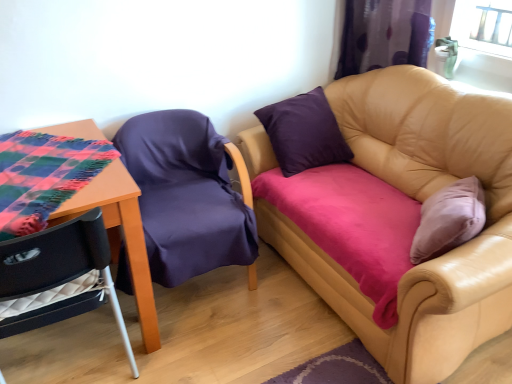
This screenshot has width=512, height=384. Find the location of `plaid fabric-covered table at left`. plaid fabric-covered table at left is located at coordinates [x=119, y=235].

The image size is (512, 384). What do you see at coordinates (60, 263) in the screenshot?
I see `velvet purple chair at lower left, arranged as the 2th chair when viewed from the right` at bounding box center [60, 263].

In order to face purple fabric curtain at upper right, should I rotate leftwards or rightwards?

Rotate right and turn 17.096 degrees.

Where is `plaid fabric-covered table at left`? Image resolution: width=512 pixels, height=384 pixels. plaid fabric-covered table at left is located at coordinates (119, 235).

In the scene shown: Can you confirm if purple fabric curtain at upper right is positioned to the left of velvet purple chair at lower left, arranged as the 2th chair when viewed from the right?

Incorrect, purple fabric curtain at upper right is not on the left side of velvet purple chair at lower left, arranged as the 2th chair when viewed from the right.

Between purple fabric curtain at upper right and velvet purple chair at lower left, arranged as the 2th chair when viewed from the right, which one has larger width?

velvet purple chair at lower left, arranged as the 2th chair when viewed from the right.

Consider the image. Is purple fabric curtain at upper right closer to camera compared to velvet purple chair at lower left, arranged as the 2th chair when viewed from the right?

No.

From the image's perspective, is purple fabric curtain at upper right located above or below velvet purple chair at lower left, arranged as the 2th chair when viewed from the right?

purple fabric curtain at upper right is situated higher than velvet purple chair at lower left, arranged as the 2th chair when viewed from the right, in the image.

In the image, is plaid fabric-covered table at left on the left side or the right side of tan leather couch at upper right?

Clearly, plaid fabric-covered table at left is on the left of tan leather couch at upper right in the image.

Is plaid fabric-covered table at left facing away from tan leather couch at upper right?

No.

Locate an element on the screen. The image size is (512, 384). table above the tan leather couch at upper right (from the image's perspective) is located at coordinates (119, 235).

Is plaid fabric-covered table at left not near tan leather couch at upper right?

Absolutely, plaid fabric-covered table at left is distant from tan leather couch at upper right.

Considering the positions of points (248, 138) and (384, 30), is point (248, 138) closer to camera compared to point (384, 30)?

That is False.

Considering the sizes of objects tan leather couch at upper right and purple fabric curtain at upper right in the image provided, who is bigger, tan leather couch at upper right or purple fabric curtain at upper right?

With larger size is tan leather couch at upper right.

From their relative heights in the image, would you say tan leather couch at upper right is taller or shorter than purple fabric curtain at upper right?

tan leather couch at upper right is taller than purple fabric curtain at upper right.

Is velvet purple chair at lower left, which ranks as the 1th chair in left-to-right order, looking in the opposite direction of tan leather couch at upper right?

velvet purple chair at lower left, which ranks as the 1th chair in left-to-right order, does not have its back to tan leather couch at upper right.

Are velvet purple chair at lower left, which ranks as the 1th chair in left-to-right order, and tan leather couch at upper right far apart?

Absolutely, velvet purple chair at lower left, which ranks as the 1th chair in left-to-right order, is distant from tan leather couch at upper right.

Considering the positions of points (94, 214) and (276, 214), is point (94, 214) farther from camera compared to point (276, 214)?

That is False.

Can you tell me how much velvet purple chair at lower left, which ranks as the 1th chair in left-to-right order, and tan leather couch at upper right differ in facing direction?

velvet purple chair at lower left, which ranks as the 1th chair in left-to-right order, and tan leather couch at upper right are facing 92.3 degrees away from each other.

From the image's perspective, which one is positioned lower, purple fabric curtain at upper right or purple fabric chair at left, the second chair in the left-to-right sequence?

purple fabric chair at left, the second chair in the left-to-right sequence, is shown below in the image.

In terms of width, does purple fabric curtain at upper right look wider or thinner when compared to purple fabric chair at left, the second chair in the left-to-right sequence?

Considering their sizes, purple fabric curtain at upper right looks slimmer than purple fabric chair at left, the second chair in the left-to-right sequence.

From the picture: Is purple fabric curtain at upper right aimed at purple fabric chair at left, the first chair viewed from the right?

Yes.

Could you tell me if plaid fabric-covered table at left is facing purple fabric curtain at upper right?

No, plaid fabric-covered table at left is not facing towards purple fabric curtain at upper right.

Between point (143, 288) and point (356, 23), which one is positioned behind?

Positioned behind is point (356, 23).

From the image's perspective, is plaid fabric-covered table at left on top of purple fabric curtain at upper right?

No, from the image's perspective, plaid fabric-covered table at left is not over purple fabric curtain at upper right.

Who is shorter, plaid fabric-covered table at left or purple fabric curtain at upper right?

plaid fabric-covered table at left is shorter.

From a real-world perspective, is plaid fabric-covered table at left beneath purple fabric chair at left, the first chair viewed from the right?

No, from a real-world perspective, plaid fabric-covered table at left is not beneath purple fabric chair at left, the first chair viewed from the right.

Is plaid fabric-covered table at left far from purple fabric chair at left, the second chair in the left-to-right sequence?

Actually, plaid fabric-covered table at left and purple fabric chair at left, the second chair in the left-to-right sequence, are a little close together.

From their relative heights in the image, would you say plaid fabric-covered table at left is taller or shorter than purple fabric chair at left, the second chair in the left-to-right sequence?

Clearly, plaid fabric-covered table at left is shorter compared to purple fabric chair at left, the second chair in the left-to-right sequence.

From the image's perspective, which chair is the 2nd one below the purple fabric curtain at upper right? Please provide its 2D coordinates.

[(60, 263)]

Identify the location of studio couch lying on the right of plaid fabric-covered table at left. This screenshot has height=384, width=512. (421, 201).

Based on their spatial positions, is plaid fabric-covered table at left or purple fabric chair at left, the second chair in the left-to-right sequence, further from purple fabric curtain at upper right?

plaid fabric-covered table at left is further to purple fabric curtain at upper right.

Which object lies nearer to the anchor point tan leather couch at upper right, purple fabric chair at left, the first chair viewed from the right, or velvet purple chair at lower left, which ranks as the 1th chair in left-to-right order?

The object closer to tan leather couch at upper right is purple fabric chair at left, the first chair viewed from the right.

Looking at the image, which one is located closer to velvet purple chair at lower left, which ranks as the 1th chair in left-to-right order, purple fabric chair at left, the first chair viewed from the right, or purple fabric curtain at upper right?

purple fabric chair at left, the first chair viewed from the right, lies closer to velvet purple chair at lower left, which ranks as the 1th chair in left-to-right order, than the other object.

Which object lies further to the anchor point purple fabric curtain at upper right, tan leather couch at upper right or plaid fabric-covered table at left?

plaid fabric-covered table at left is further to purple fabric curtain at upper right.

Based on their spatial positions, is plaid fabric-covered table at left or velvet purple chair at lower left, which ranks as the 1th chair in left-to-right order, closer to tan leather couch at upper right?

plaid fabric-covered table at left is positioned closer to the anchor tan leather couch at upper right.

Looking at the image, which one is located closer to purple fabric chair at left, the first chair viewed from the right, tan leather couch at upper right or velvet purple chair at lower left, which ranks as the 1th chair in left-to-right order?

velvet purple chair at lower left, which ranks as the 1th chair in left-to-right order, is positioned closer to the anchor purple fabric chair at left, the first chair viewed from the right.

Estimate the real-world distances between objects in this image. Which object is further from purple fabric chair at left, the second chair in the left-to-right sequence, tan leather couch at upper right or purple fabric curtain at upper right?

Based on the image, purple fabric curtain at upper right appears to be further to purple fabric chair at left, the second chair in the left-to-right sequence.

Considering their positions, is velvet purple chair at lower left, which ranks as the 1th chair in left-to-right order, positioned further to plaid fabric-covered table at left than purple fabric curtain at upper right?

Among the two, purple fabric curtain at upper right is located further to plaid fabric-covered table at left.

What are the coordinates of `studio couch situated between plaid fabric-covered table at left and purple fabric curtain at upper right from left to right` in the screenshot? It's located at (421, 201).

This screenshot has height=384, width=512. I want to click on chair between velvet purple chair at lower left, which ranks as the 1th chair in left-to-right order, and purple fabric curtain at upper right, so click(186, 195).

Where is `chair between plaid fabric-covered table at left and purple fabric chair at left, the second chair in the left-to-right sequence, in the horizontal direction`? Image resolution: width=512 pixels, height=384 pixels. chair between plaid fabric-covered table at left and purple fabric chair at left, the second chair in the left-to-right sequence, in the horizontal direction is located at coordinates (60, 263).

In order to click on studio couch between purple fabric chair at left, the first chair viewed from the right, and purple fabric curtain at upper right from left to right in this screenshot , I will do `click(421, 201)`.